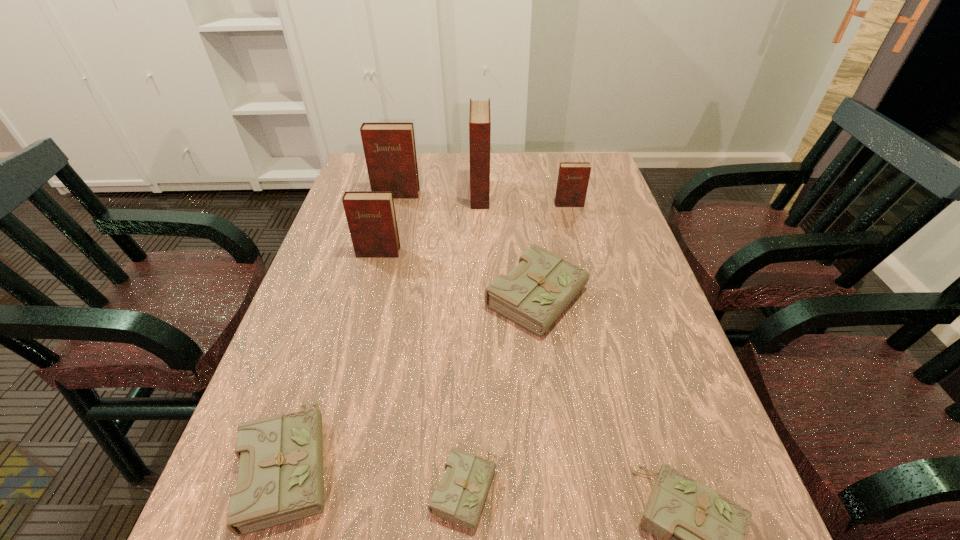
Locate an element on the screen. The width and height of the screenshot is (960, 540). the biggest reddish-brown diary is located at coordinates (479, 115).

Image resolution: width=960 pixels, height=540 pixels. Identify the location of the tallest diary. (479, 115).

Locate an element on the screen. The image size is (960, 540). the third smallest reddish-brown diary is located at coordinates (389, 148).

I want to click on the second tallest diary, so click(389, 148).

I want to click on the third tallest object, so click(x=371, y=218).

I want to click on the fifth nearest diary, so 371,218.

Where is `the fourth tallest diary`? Image resolution: width=960 pixels, height=540 pixels. the fourth tallest diary is located at coordinates (573, 177).

I want to click on the rightmost reddish-brown diary, so click(x=573, y=177).

The image size is (960, 540). I want to click on the fifth farthest diary, so click(x=533, y=294).

Find the location of a particular element. the fifth tallest object is located at coordinates (533, 294).